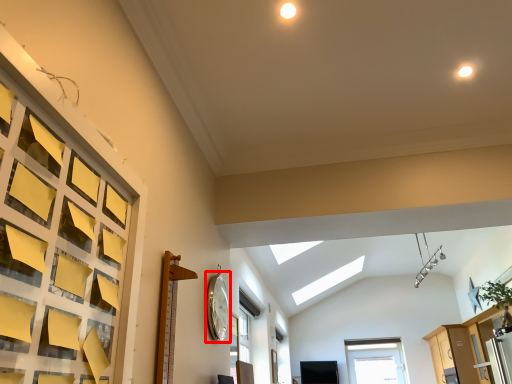
Question: From the image's perspective, where is clock (annotated by the red box) located in relation to dresser in the image?

Choices:
 (A) below
 (B) above

Answer: (B)